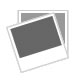
Where is `white bottom border`? The image size is (80, 80). white bottom border is located at coordinates (44, 58).